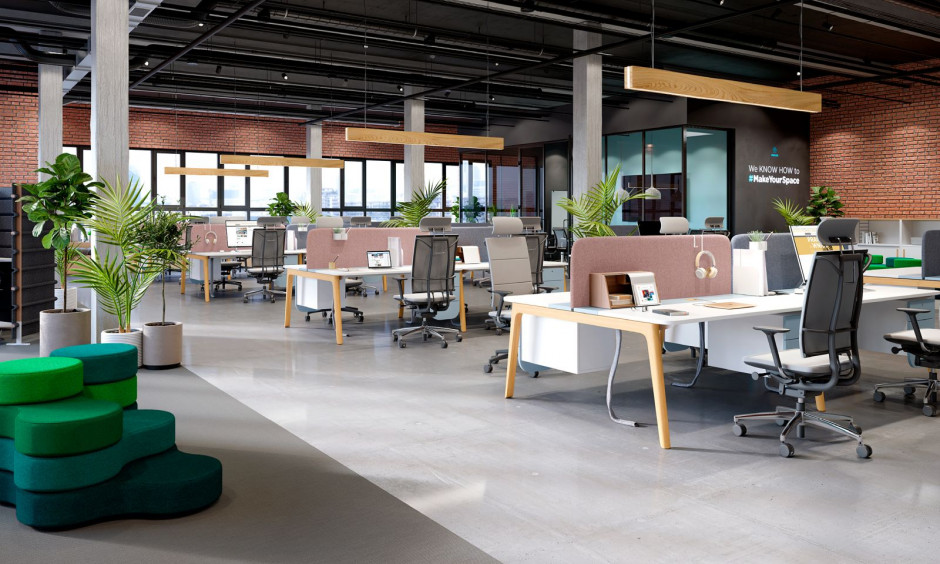
Find the location of a particular element. ceiling support bars is located at coordinates (343, 27), (323, 63), (298, 90), (288, 111), (535, 12), (874, 19).